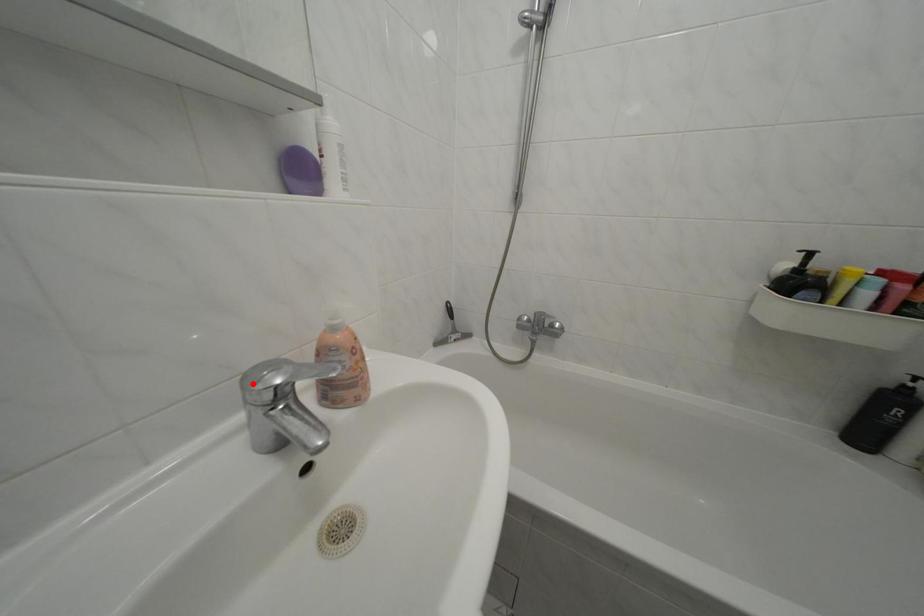
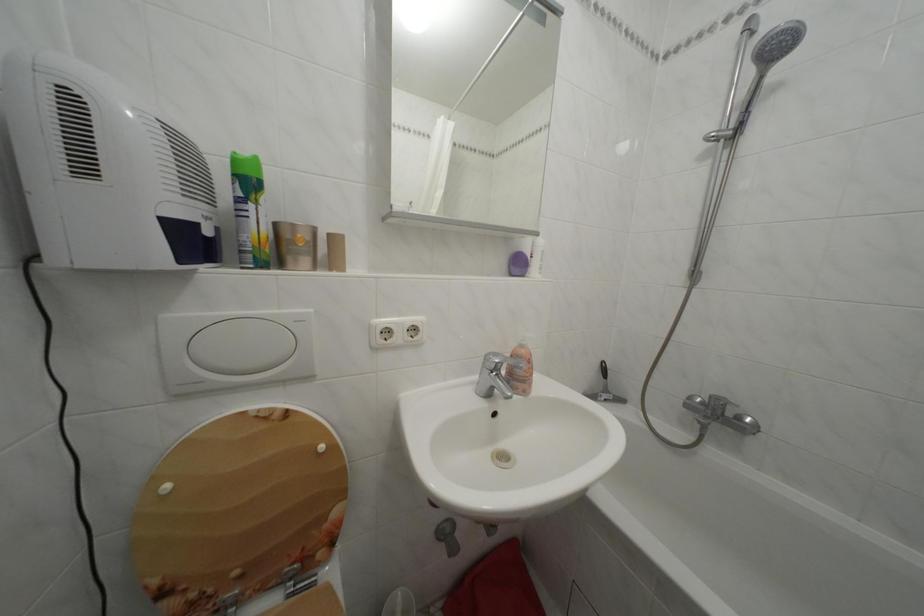
Locate, in the second image, the point that corresponds to the highlighted location in the first image.

(495, 362)